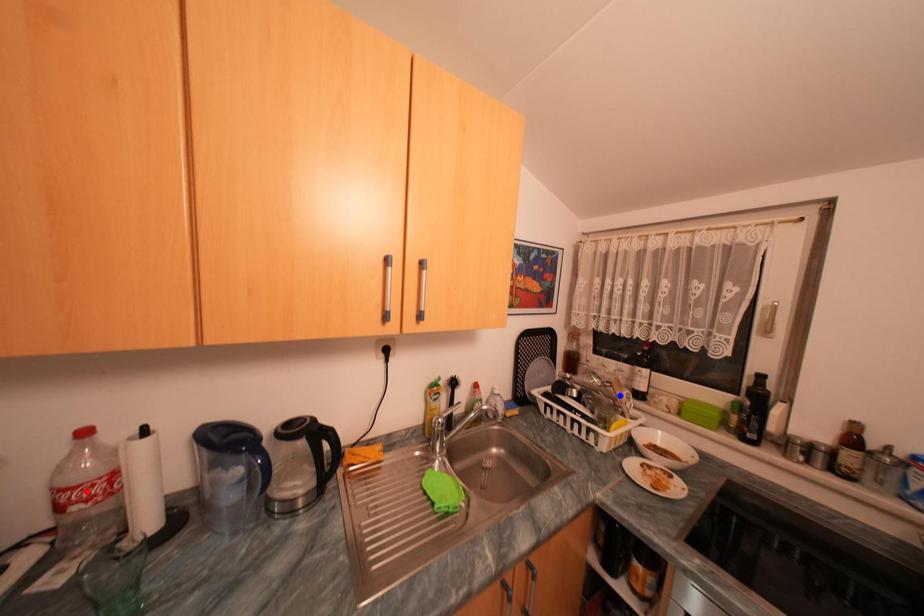
Question: Two points are marked on the image. Which point is closer to the camera?

Choices:
 (A) Blue point is closer.
 (B) Red point is closer.

Answer: (B)